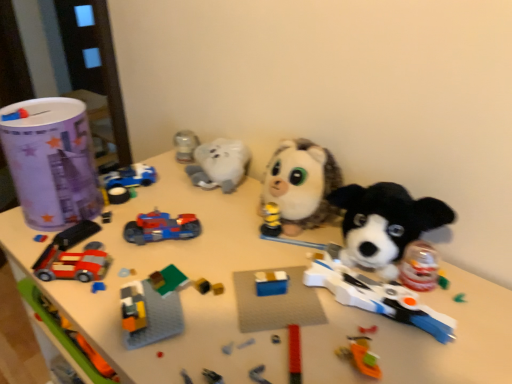
Locate an element on the screen. The height and width of the screenshot is (384, 512). vacant area that is in front of fluffy white plush at center, placed as the 5th toy when sorted from left to right is located at coordinates (273, 274).